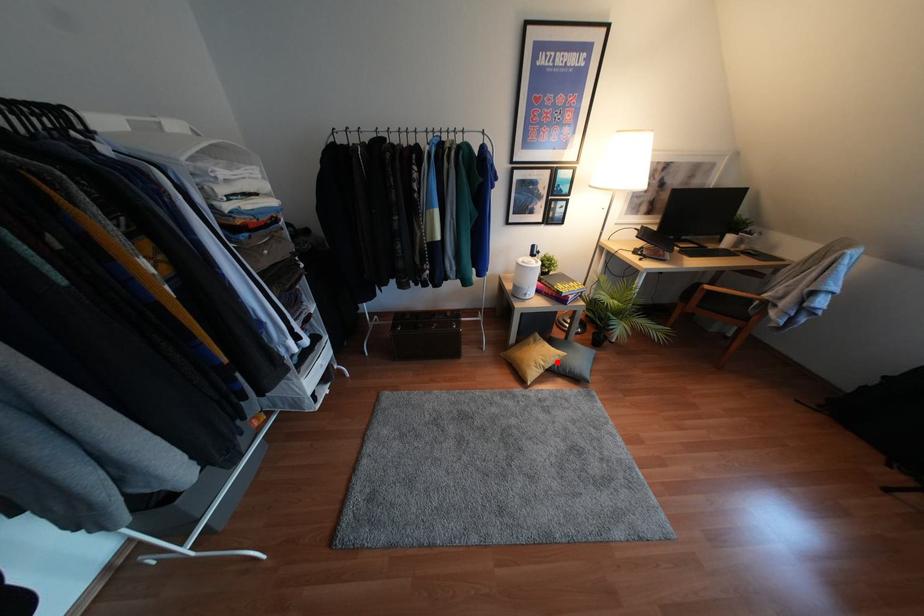
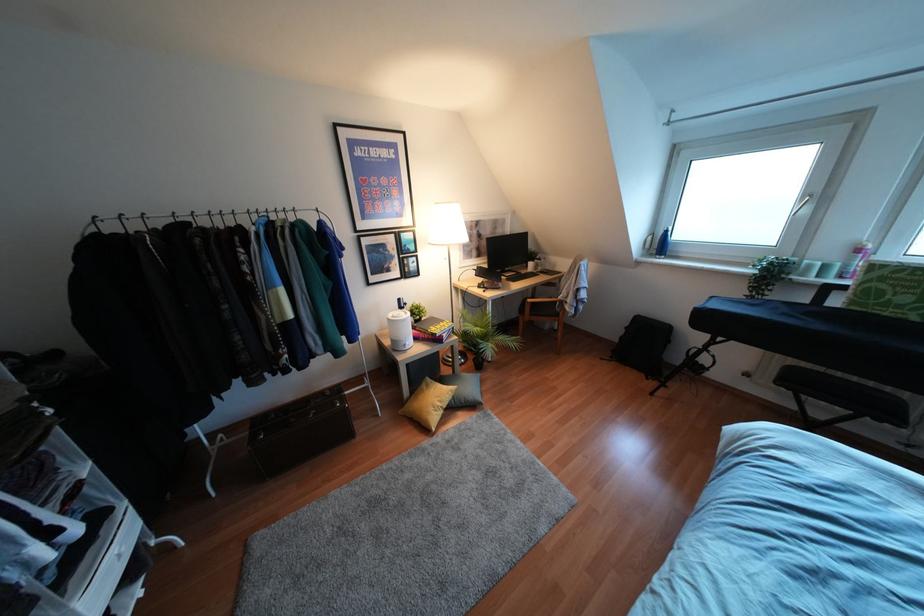
Find the pixel in the second image that matches the highlighted location in the first image.

(453, 397)